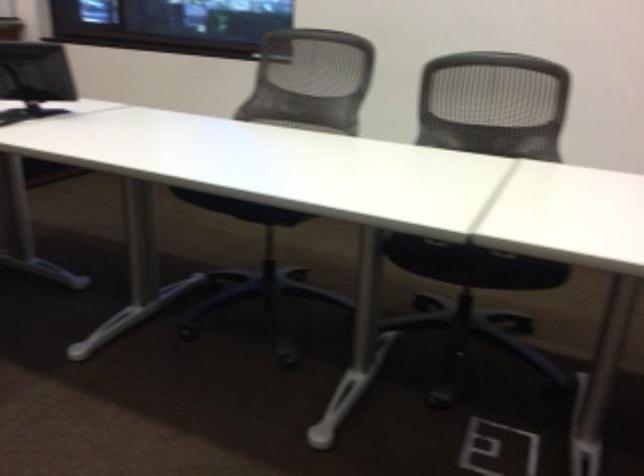
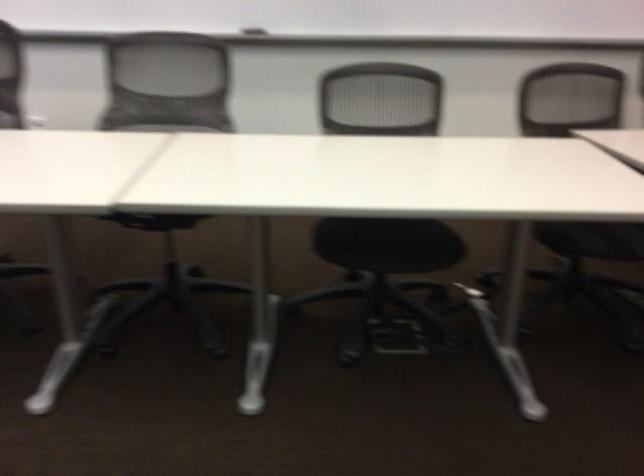
How did the camera likely rotate?

The camera's rotation is toward right-down.